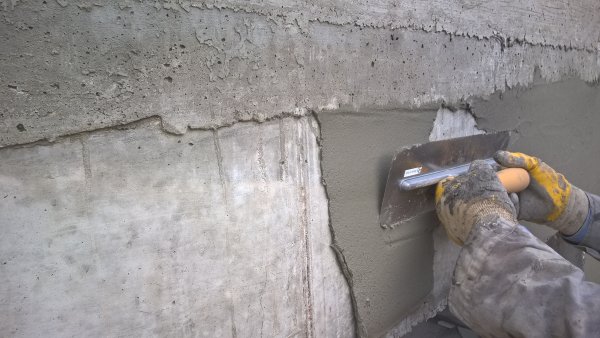
Locate an element on the screen. The height and width of the screenshot is (338, 600). handle is located at coordinates (516, 175).